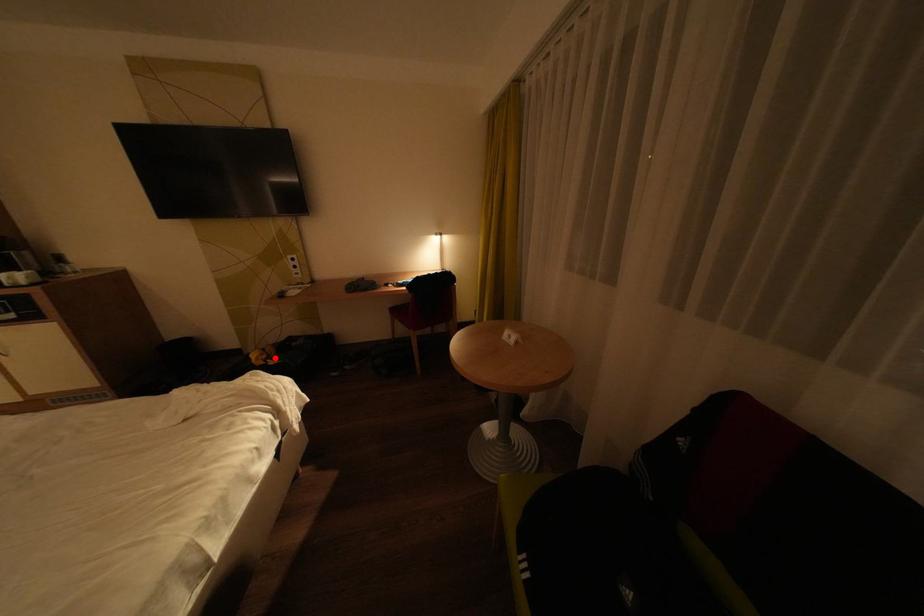
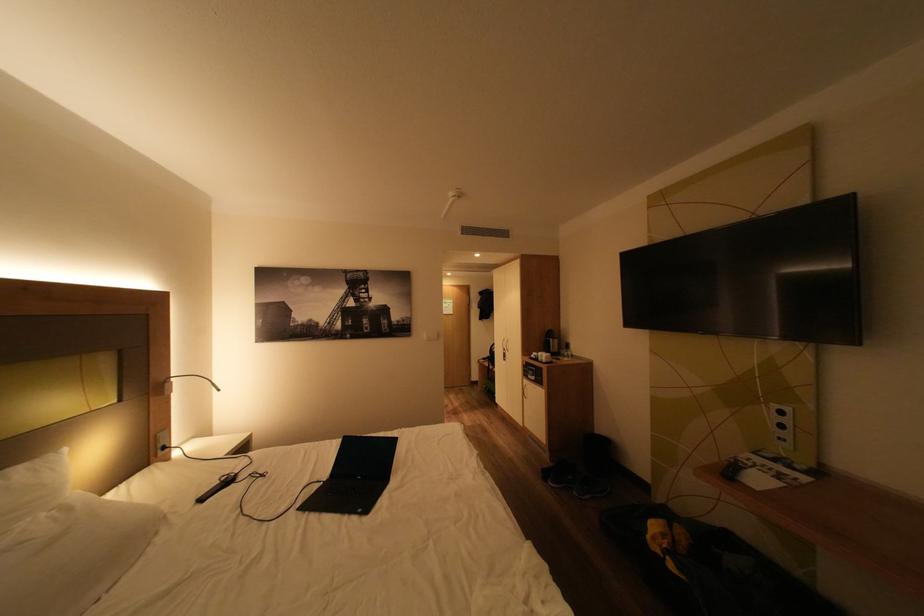
Question: I am providing you with two images of the same scene from different viewpoints. A red point is marked on the first image. Can you still see the location of the red point in image 2?

Choices:
 (A) Yes
 (B) No

Answer: (A)